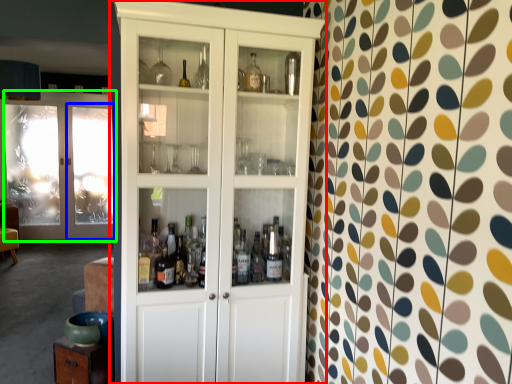
Question: Which object is the farthest from cupboard (highlighted by a red box)? Choose among these: screen door (highlighted by a blue box) or door (highlighted by a green box).

Choices:
 (A) screen door
 (B) door

Answer: (B)